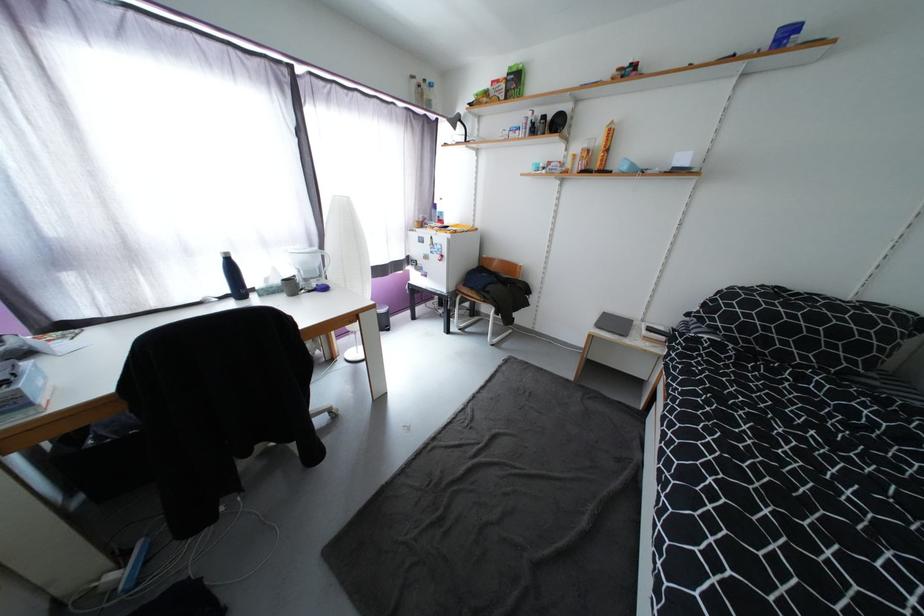
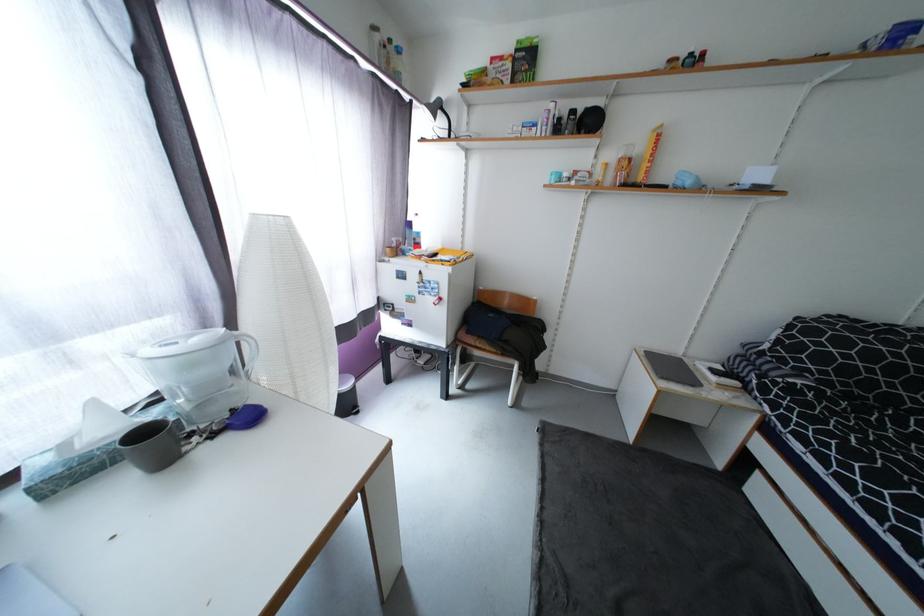
Locate, in the second image, the point that corresponds to pixel 480 297 in the first image.

(493, 349)